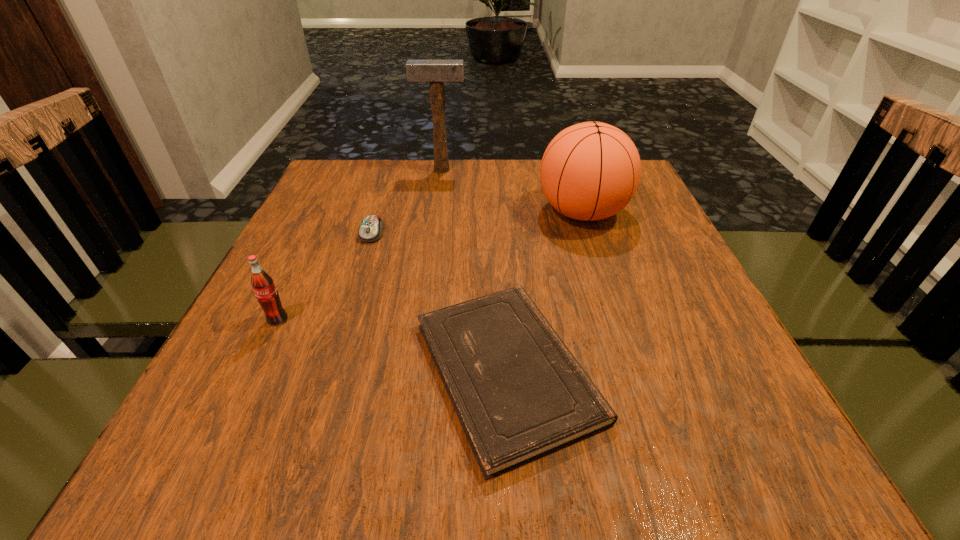
Where is `vacant space located 0.060m on the wheel side of the computer mouse`? The image size is (960, 540). vacant space located 0.060m on the wheel side of the computer mouse is located at coordinates (363, 261).

Identify the location of vacant space located on the back of the paperback book. (498, 222).

Locate an element on the screen. mallet that is at the far edge is located at coordinates (436, 72).

Image resolution: width=960 pixels, height=540 pixels. Identify the location of basketball at the far edge. (590, 171).

Identify the location of object located in the near edge section of the desktop. (519, 393).

Where is `soda bottle that is at the left edge`? The image size is (960, 540). soda bottle that is at the left edge is located at coordinates (262, 283).

At what (x,y) coordinates should I click in order to perform the action: click on computer mouse that is at the left edge. Please return your answer as a coordinate pair (x, y). Image resolution: width=960 pixels, height=540 pixels. Looking at the image, I should click on (371, 229).

Image resolution: width=960 pixels, height=540 pixels. Find the location of `object situated at the right edge`. object situated at the right edge is located at coordinates (590, 171).

What are the coordinates of `object present at the far right corner` in the screenshot? It's located at (590, 171).

The width and height of the screenshot is (960, 540). I want to click on vacant region at the far edge of the desktop, so click(406, 185).